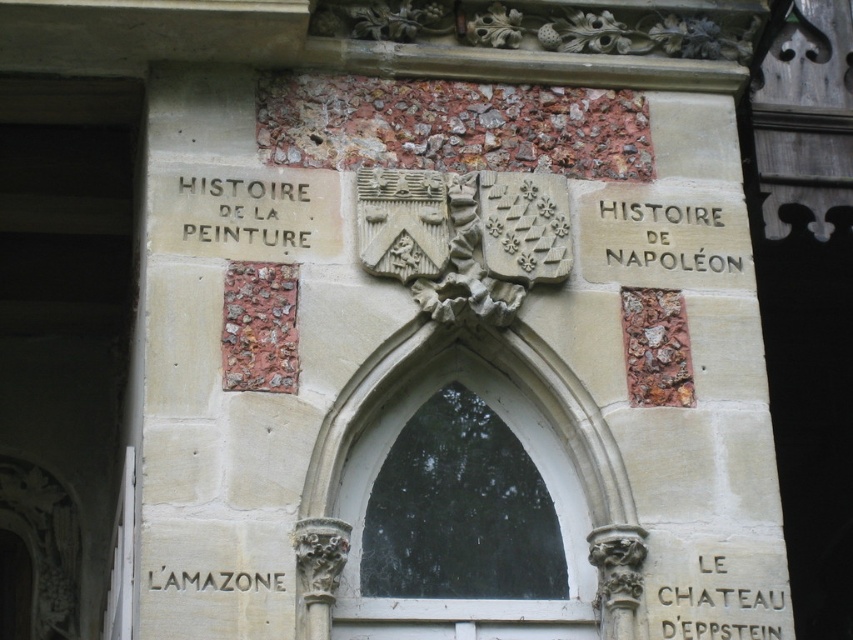
Question: Observing the image, what is the correct spatial positioning of white stone text at lower right in reference to matte stone l'amazone at lower center?

Choices:
 (A) left
 (B) right

Answer: (B)

Question: Which point is farther to the camera?

Choices:
 (A) (622, 584)
 (B) (177, 570)

Answer: (A)

Question: Which object is farther from the camera taking this photo?

Choices:
 (A) matte stone l'amazone at lower center
 (B) white stone text at lower right
 (C) smooth stone arch at center

Answer: (B)

Question: Among these points, which one is nearest to the camera?

Choices:
 (A) (421, 369)
 (B) (676, 577)
 (C) (228, 227)

Answer: (B)

Question: Does smooth stone arch at center have a lesser width compared to white stone text at upper center?

Choices:
 (A) no
 (B) yes

Answer: (A)

Question: Can you confirm if smooth stone arch at center is positioned to the right of matte stone l'amazone at lower center?

Choices:
 (A) no
 (B) yes

Answer: (B)